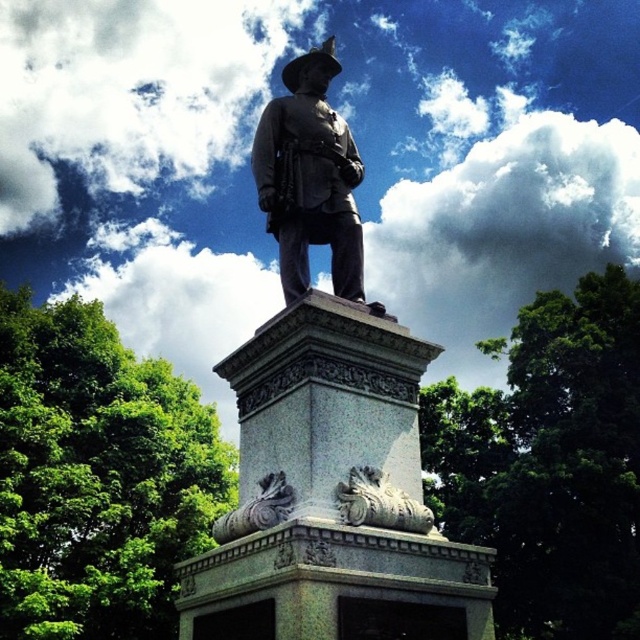
Question: Is polished bronze statue at center behind carved stone lion at lower center?

Choices:
 (A) yes
 (B) no

Answer: (A)

Question: Among these points, which one is nearest to the camera?

Choices:
 (A) (257, 160)
 (B) (384, 504)
 (C) (262, 492)

Answer: (B)

Question: Which point is farther from the camera taking this photo?

Choices:
 (A) click(x=300, y=618)
 (B) click(x=218, y=525)
 (C) click(x=337, y=278)

Answer: (C)

Question: Does polished bronze statue at center have a larger size compared to carved stone ornament at center?

Choices:
 (A) yes
 (B) no

Answer: (A)

Question: Which is farther from the carved stone lion at lower center?

Choices:
 (A) gray stone statue at center
 (B) polished bronze statue at center
 (C) carved stone ornament at center

Answer: (B)

Question: Is gray stone statue at center positioned at the back of polished bronze statue at center?

Choices:
 (A) yes
 (B) no

Answer: (B)